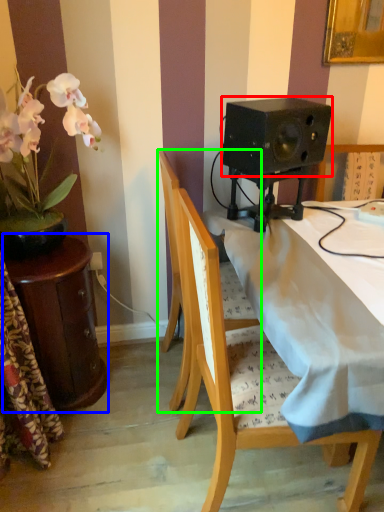
Question: Which object is positioned closest to speaker (highlighted by a red box)? Select from table (highlighted by a blue box) and chair (highlighted by a green box).

Choices:
 (A) table
 (B) chair

Answer: (B)